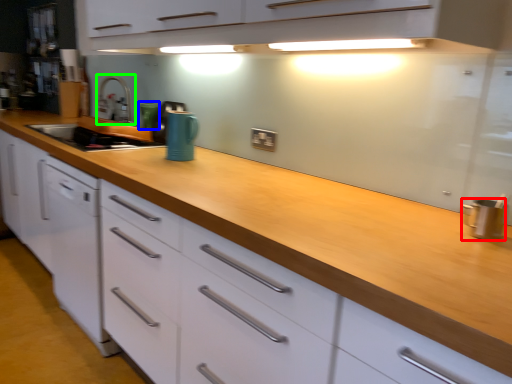
Question: Which is nearer to the kitchen appliance (highlighted by a red box)? appliance (highlighted by a blue box) or faucet (highlighted by a green box).

Choices:
 (A) appliance
 (B) faucet

Answer: (A)